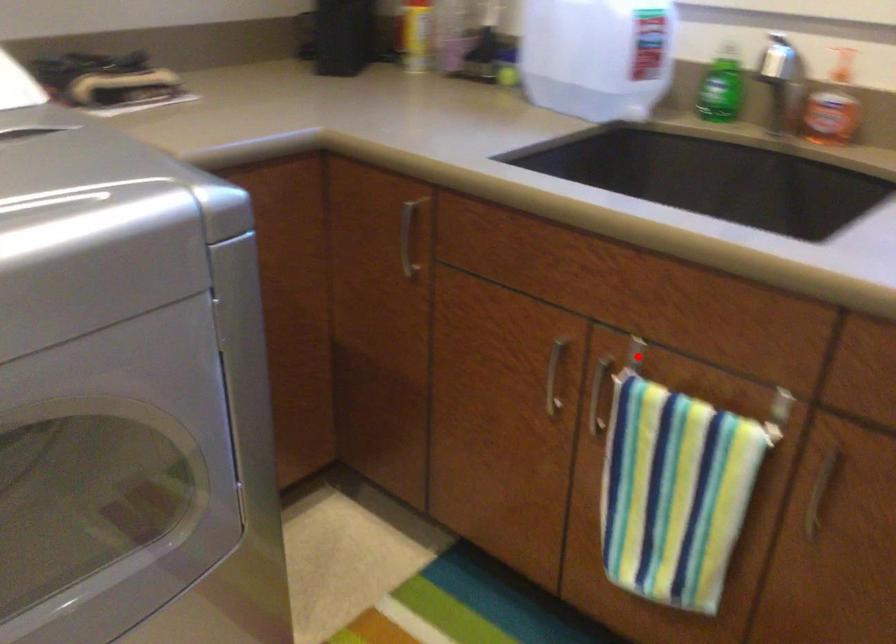
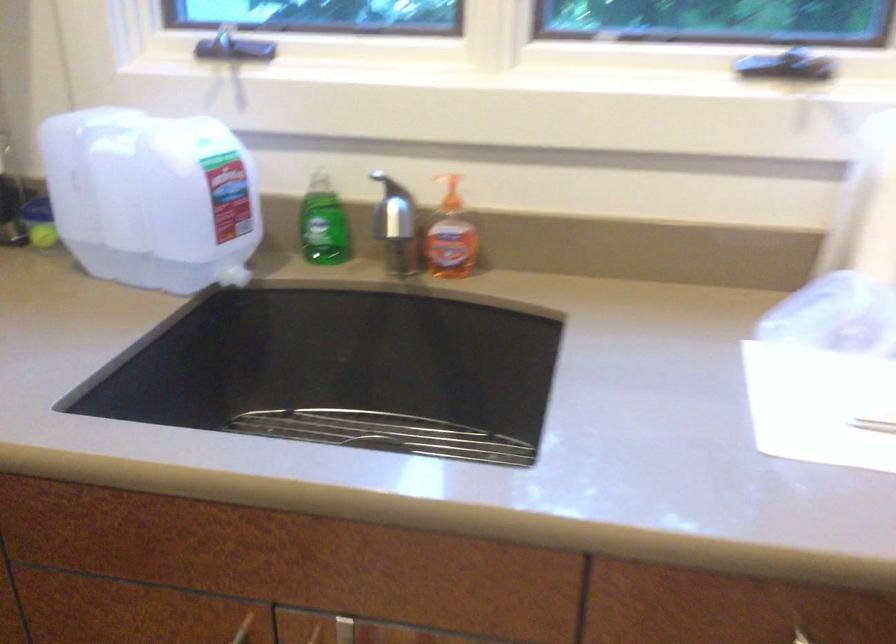
Question: I am providing you with two images of the same scene from different viewpoints. A red point is shown in image1. For the corresponding object point in image2, is it positioned nearer or farther from the camera?

Choices:
 (A) Nearer
 (B) Farther

Answer: (A)